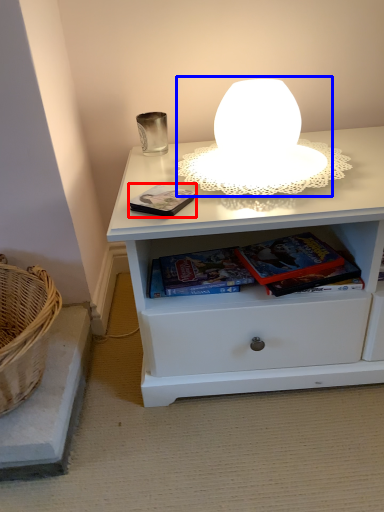
Question: Which of the following is the closest to the observer, paperback book (highlighted by a red box) or table lamp (highlighted by a blue box)?

Choices:
 (A) paperback book
 (B) table lamp

Answer: (B)